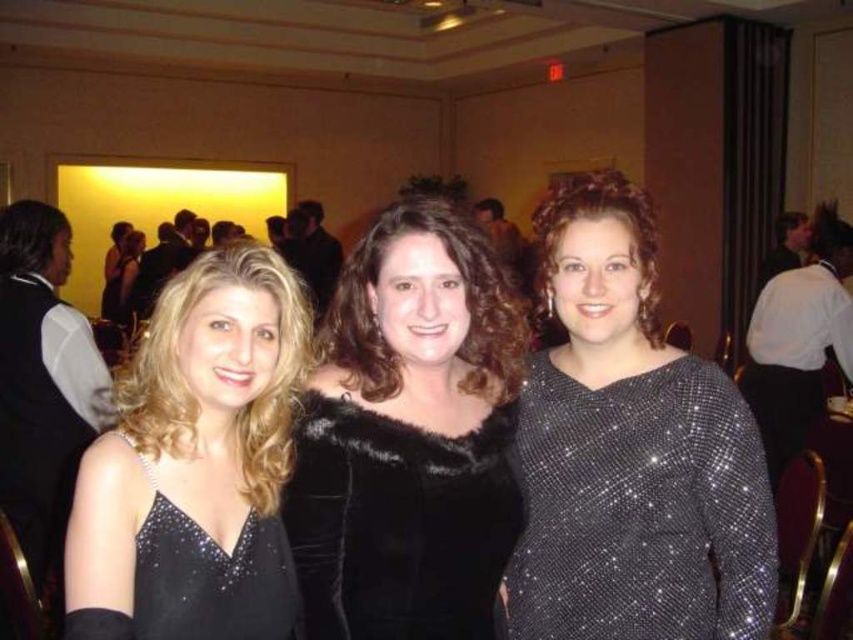
Question: Which object is closer to the camera taking this photo?

Choices:
 (A) sparkly black dress at left
 (B) satin black dress at left

Answer: (B)

Question: Does sparkly silver dress at center have a larger size compared to velvet black fur coat at center?

Choices:
 (A) yes
 (B) no

Answer: (B)

Question: Which is farther from the satin black dress at left?

Choices:
 (A) velvet black fur coat at center
 (B) sparkly black dress at left

Answer: (A)

Question: Is velvet black fur coat at center positioned before satin black dress at left?

Choices:
 (A) yes
 (B) no

Answer: (B)

Question: Among these objects, which one is farthest from the camera?

Choices:
 (A) velvet black fur coat at center
 (B) sparkly silver dress at center

Answer: (B)

Question: Can you confirm if sparkly silver dress at center is positioned to the right of velvet black fur coat at center?

Choices:
 (A) no
 (B) yes

Answer: (B)